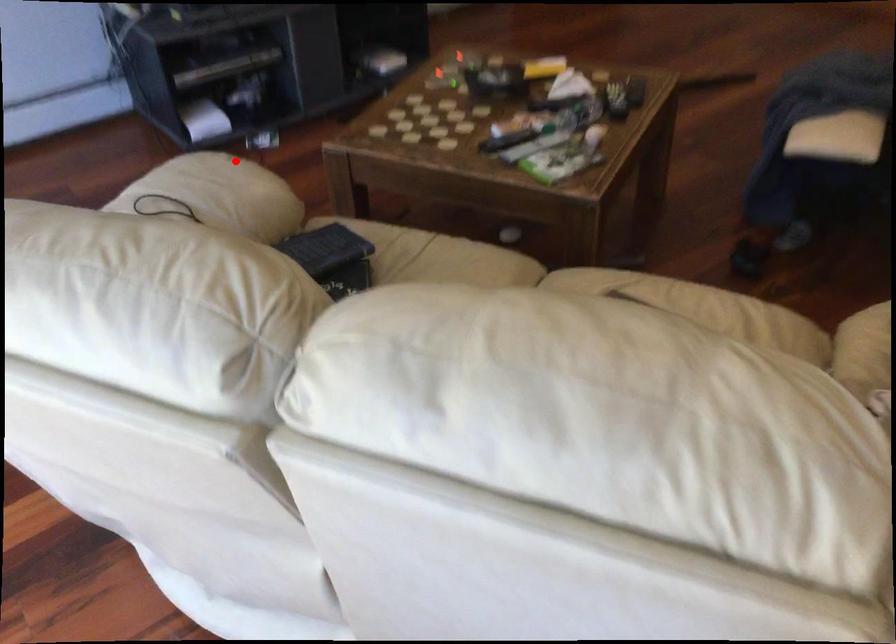
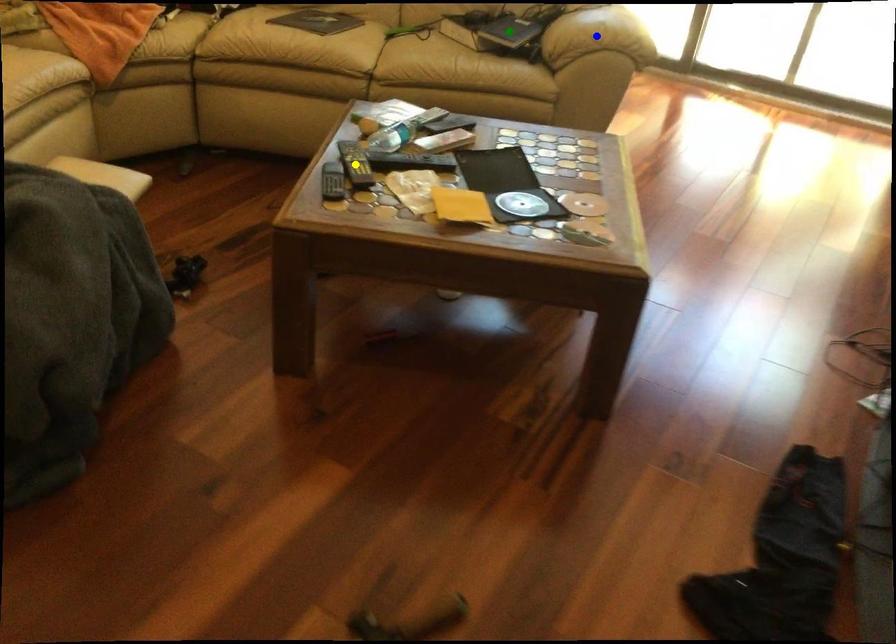
Question: I am providing you with two images of the same scene from different viewpoints. A red point is marked on the first image. You are given multiple points on the second image. Which spot in image 2 lines up with the point in image 1?

Choices:
 (A) blue point
 (B) green point
 (C) yellow point

Answer: (A)